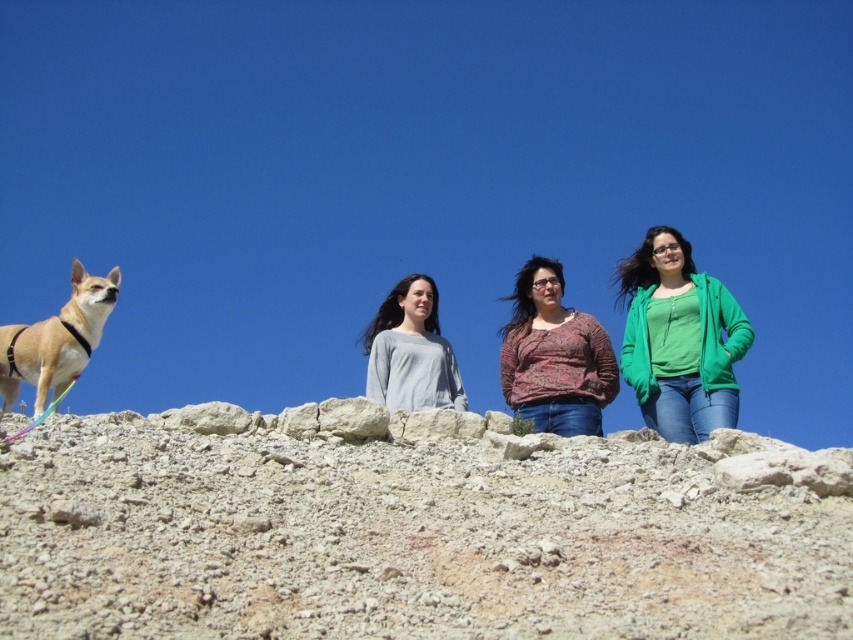
Who is more forward, [792,609] or [567,320]?

Point [792,609] is more forward.

Is rough textured dirt at center above printed cotton shirt at center?

Actually, rough textured dirt at center is below printed cotton shirt at center.

Which is behind, point (84, 477) or point (579, 390)?

The point (579, 390) is more distant.

You are a GUI agent. You are given a task and a screenshot of the screen. Output one action in this format:
    pyautogui.click(x=<x>, y=<y>)
    Task: Click on the rough textured dirt at center
    Image resolution: width=853 pixels, height=640 pixels.
    Given the screenshot: What is the action you would take?
    click(402, 540)

Does rough textured dirt at center have a smaller size compared to gray matte shirt at center?

Incorrect, rough textured dirt at center is not smaller in size than gray matte shirt at center.

Looking at this image, is rough textured dirt at center positioned at the back of gray matte shirt at center?

No, it is in front of gray matte shirt at center.

Find the location of a particular element. This screenshot has height=640, width=853. rough textured dirt at center is located at coordinates (402, 540).

From the picture: Is green matte jacket at right thinner than light brown fur at left?

Incorrect, green matte jacket at right's width is not less than light brown fur at left's.

Can you confirm if green matte jacket at right is smaller than light brown fur at left?

Actually, green matte jacket at right might be larger than light brown fur at left.

The image size is (853, 640). What do you see at coordinates (679, 339) in the screenshot? I see `green matte jacket at right` at bounding box center [679, 339].

The height and width of the screenshot is (640, 853). Find the location of `green matte jacket at right`. green matte jacket at right is located at coordinates (679, 339).